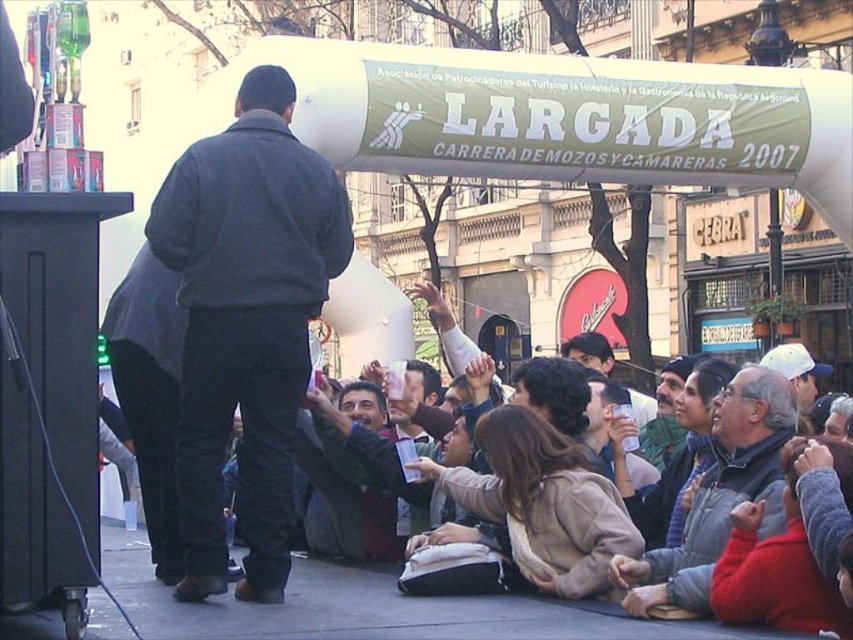
Locate an element on the screen. The height and width of the screenshot is (640, 853). concrete pavement at lower center is located at coordinates (375, 609).

Can you confirm if concrete pavement at lower center is bigger than gray wool sweater at lower right?

Incorrect, concrete pavement at lower center is not larger than gray wool sweater at lower right.

Is point (103, 634) closer to camera compared to point (743, 484)?

Yes, point (103, 634) is closer to viewer.

Locate an element on the screen. The image size is (853, 640). concrete pavement at lower center is located at coordinates (375, 609).

The width and height of the screenshot is (853, 640). What do you see at coordinates (247, 321) in the screenshot?
I see `dark gray fleece jacket at center` at bounding box center [247, 321].

From the picture: Between dark gray fleece jacket at center and concrete pavement at lower center, which one has less height?

concrete pavement at lower center

Which is in front, point (271, 525) or point (466, 621)?

Point (466, 621) is more forward.

Find the location of a particular element. This screenshot has width=853, height=640. dark gray fleece jacket at center is located at coordinates point(247,321).

Can you confirm if gray wool sweater at lower right is shorter than smooth brown jacket at center?

In fact, gray wool sweater at lower right may be taller than smooth brown jacket at center.

Can you confirm if gray wool sweater at lower right is positioned to the left of smooth brown jacket at center?

In fact, gray wool sweater at lower right is to the right of smooth brown jacket at center.

Is point (718, 416) behind point (563, 353)?

That is False.

At what (x,y) coordinates should I click in order to perform the action: click on gray wool sweater at lower right. Please return your answer as a coordinate pair (x, y). The image size is (853, 640). Looking at the image, I should click on (718, 493).